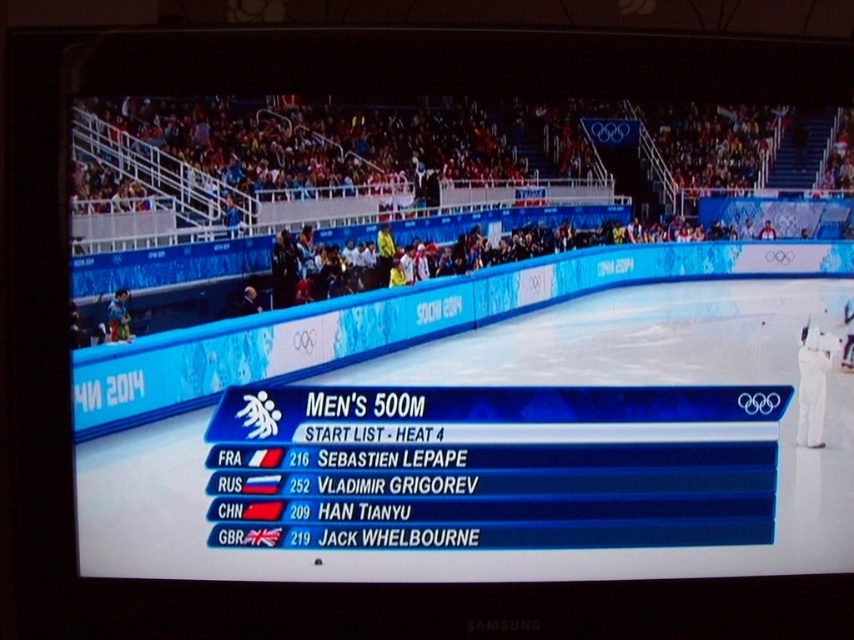
You are standing in front of the TV screen watching the Men 500m speed skating event. You notice two points on the screen at coordinates point (609, 339) and point (825, 396). Which point is closer to you?

Point (609, 339) is closer to you because it is further to the viewer than point (825, 396).

You are a photographer standing in front of the television screen. You want to take a photo of the white glossy scoreboard at center and the white cotton pants at right. Which object should you focus on first if you want to capture both in the same frame without moving the camera?

The white glossy scoreboard at center is wider than the white cotton pants at right, so you should focus on the scoreboard first to ensure both fit in the frame.

You are a spectator at the 2014 Sochi Winter Olympics and you see the white glossy scoreboard at center and the white cotton pants at right. Which object is closer to the left side of the image?

The white glossy scoreboard at center is closer to the left side of the image because it is positioned to the left of the white cotton pants at right.